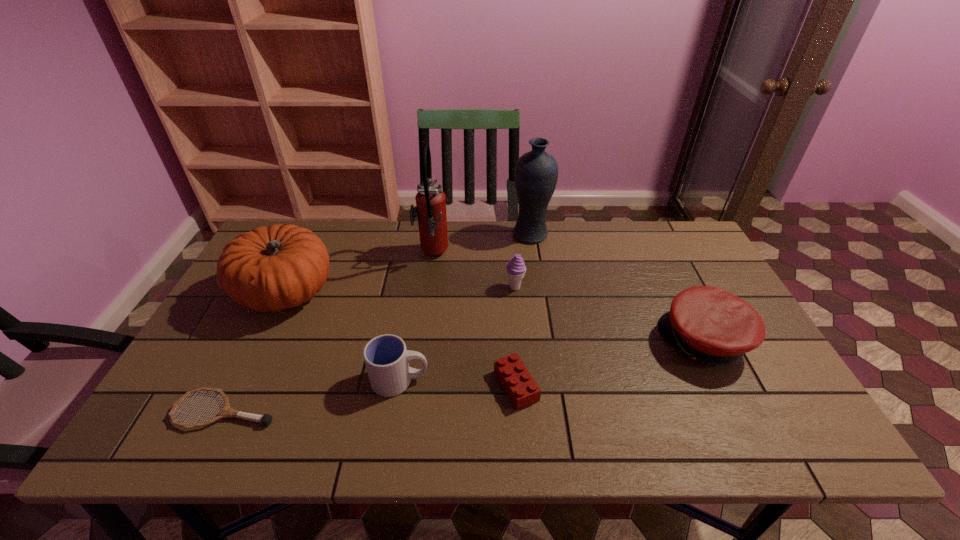
Find the location of a particular element. free space at the right edge of the desktop is located at coordinates (774, 380).

Where is `free space at the far left corner of the desktop`? free space at the far left corner of the desktop is located at coordinates (296, 221).

This screenshot has width=960, height=540. I want to click on vacant space at the far right corner of the desktop, so click(x=671, y=221).

Where is `vacant area that lies between the pumpkin and the cap`? This screenshot has height=540, width=960. vacant area that lies between the pumpkin and the cap is located at coordinates (495, 318).

What are the coordinates of `free space between the fire extinguisher and the pumpkin` in the screenshot? It's located at point(359,274).

The height and width of the screenshot is (540, 960). I want to click on free space between the vase and the sixth shortest object, so click(408, 264).

Identify the location of vacant region between the tennis racket and the vase. (378, 322).

This screenshot has height=540, width=960. I want to click on vacant space that's between the cap and the vase, so click(617, 288).

This screenshot has height=540, width=960. Identify the location of free space between the cup and the vase. (466, 307).

This screenshot has width=960, height=540. I want to click on vacant space in between the vase and the cap, so click(x=617, y=288).